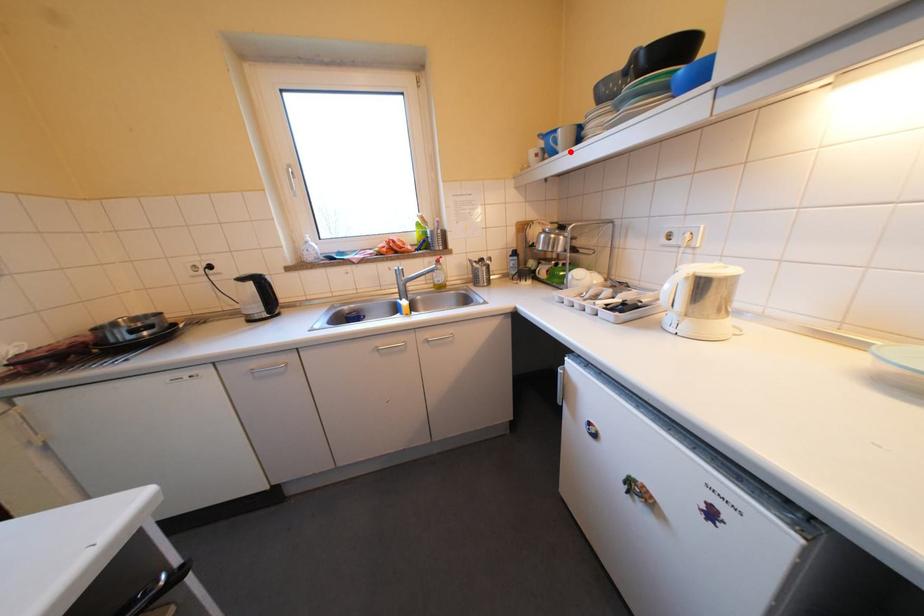
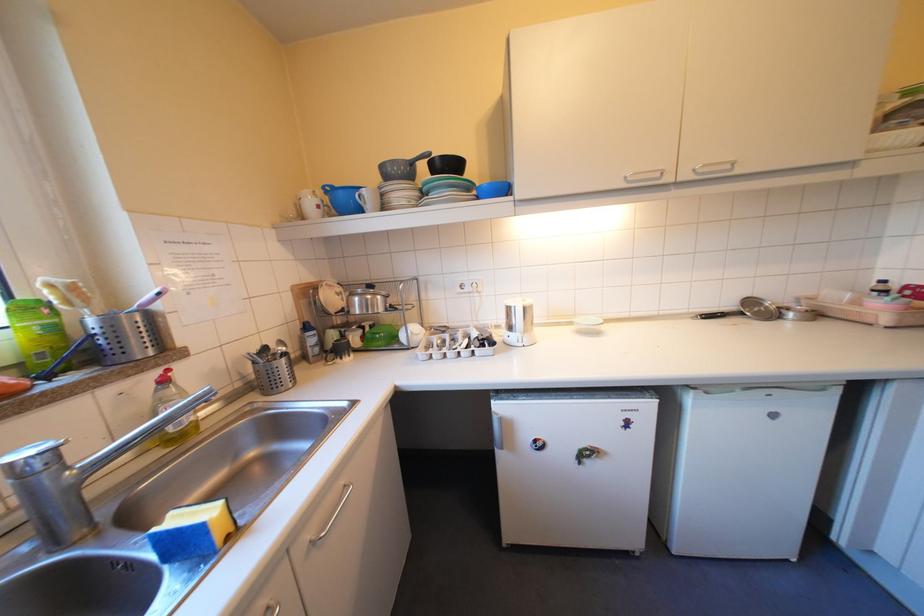
In the second image, find the point that corresponds to the highlighted location in the first image.

(373, 209)